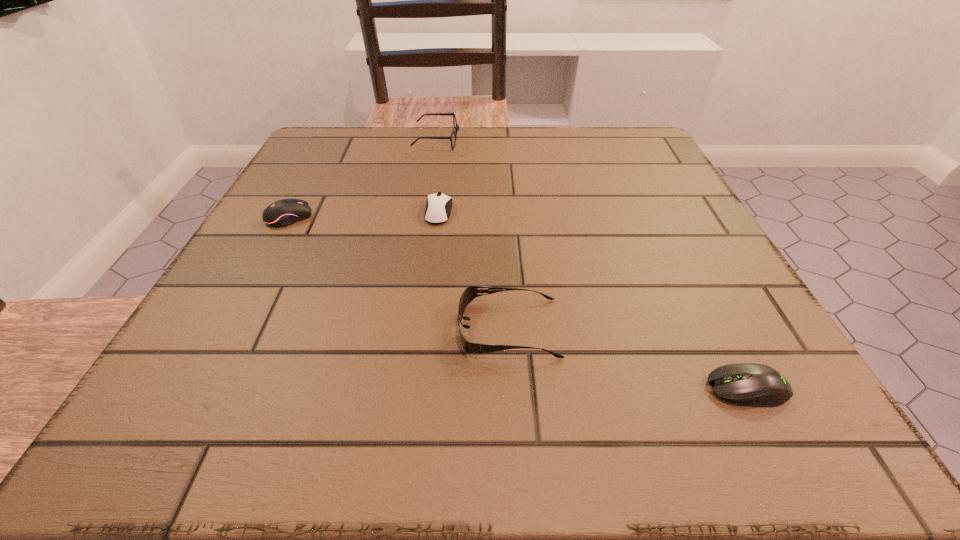
At what (x,y) coordinates should I click in order to perform the action: click on object present at the right edge. Please return your answer as a coordinate pair (x, y). The image size is (960, 540). Looking at the image, I should click on (748, 384).

What are the coordinates of `object that is positioned at the near right corner` in the screenshot? It's located at (748, 384).

In the image, there is a desktop. Where is `vacant region at the far edge`? The width and height of the screenshot is (960, 540). vacant region at the far edge is located at coordinates (443, 168).

What are the coordinates of `vacant area at the near edge` in the screenshot? It's located at (299, 399).

The width and height of the screenshot is (960, 540). What are the coordinates of `vacant space at the left edge of the desktop` in the screenshot? It's located at (241, 344).

The image size is (960, 540). Identify the location of vacant position at the right edge of the desktop. (698, 293).

This screenshot has width=960, height=540. I want to click on blank space at the far left corner of the desktop, so click(x=354, y=159).

The height and width of the screenshot is (540, 960). In the image, there is a desktop. What are the coordinates of `blank space at the near left corner` in the screenshot? It's located at coord(207,399).

This screenshot has width=960, height=540. In the image, there is a desktop. In order to click on blank space at the far right corner in this screenshot , I will do `click(636, 147)`.

Locate an element on the screen. free space between the leftmost computer mouse and the second computer mouse from left to right is located at coordinates (364, 214).